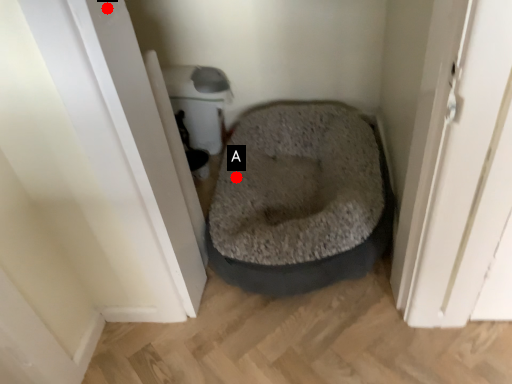
Question: Two points are circled on the image, labeled by A and B beside each circle. Which point is closer to the camera taking this photo?

Choices:
 (A) A is closer
 (B) B is closer

Answer: (B)